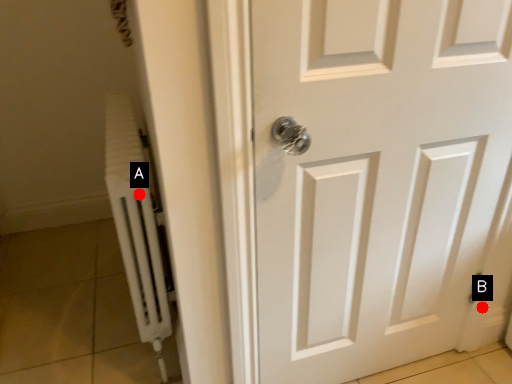
Question: Two points are circled on the image, labeled by A and B beside each circle. Which point appears farthest from the camera in this image?

Choices:
 (A) A is further
 (B) B is further

Answer: (B)